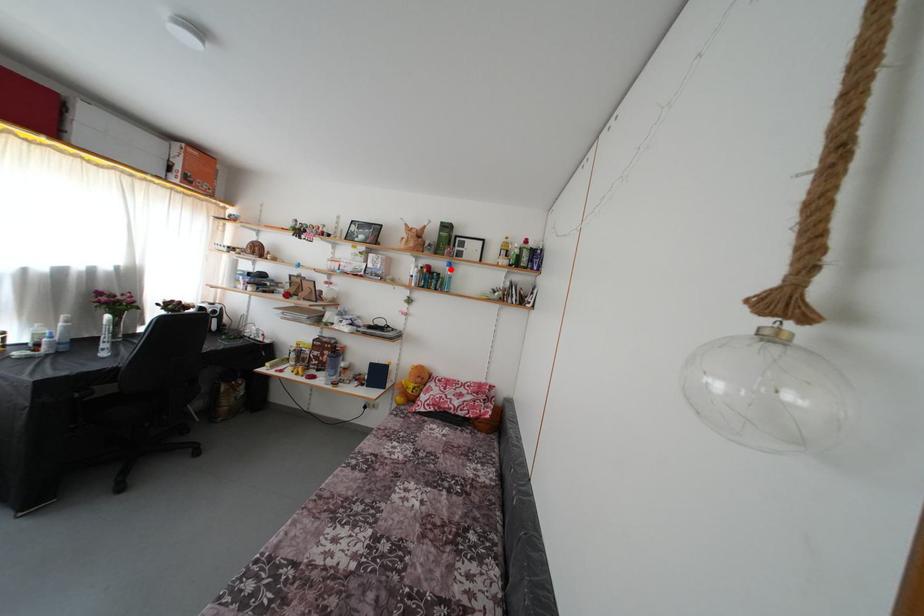
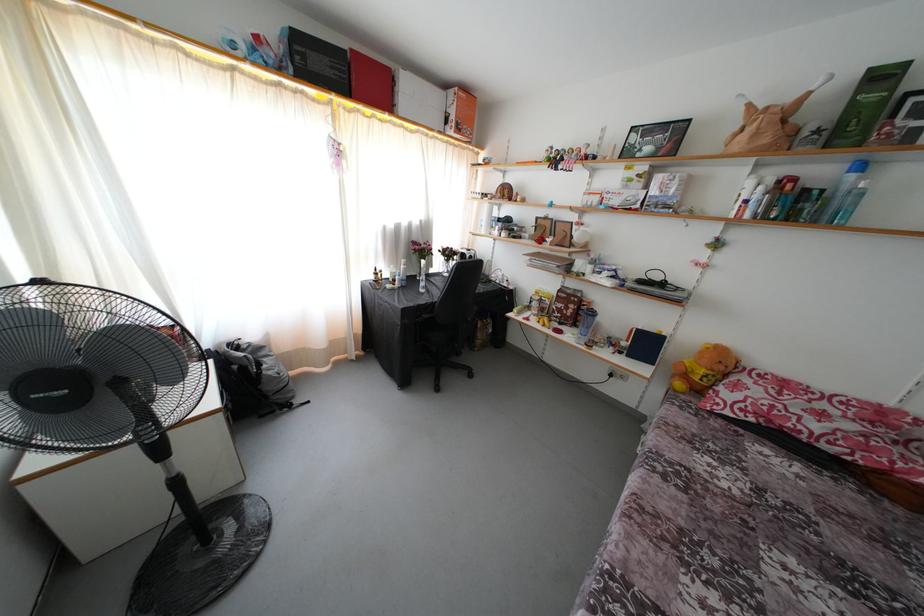
The point at the highlighted location is marked in the first image. Where is the corresponding point in the second image?

(849, 172)